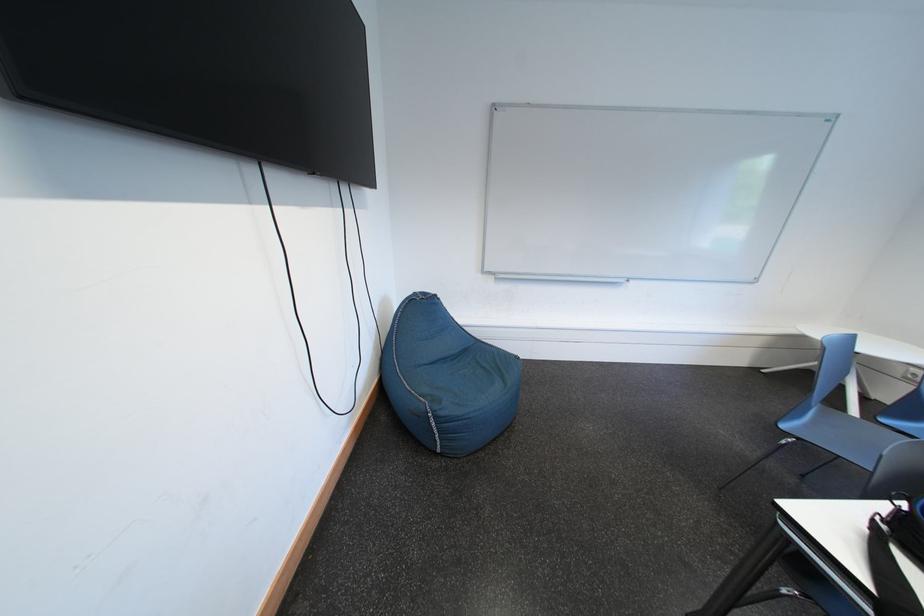
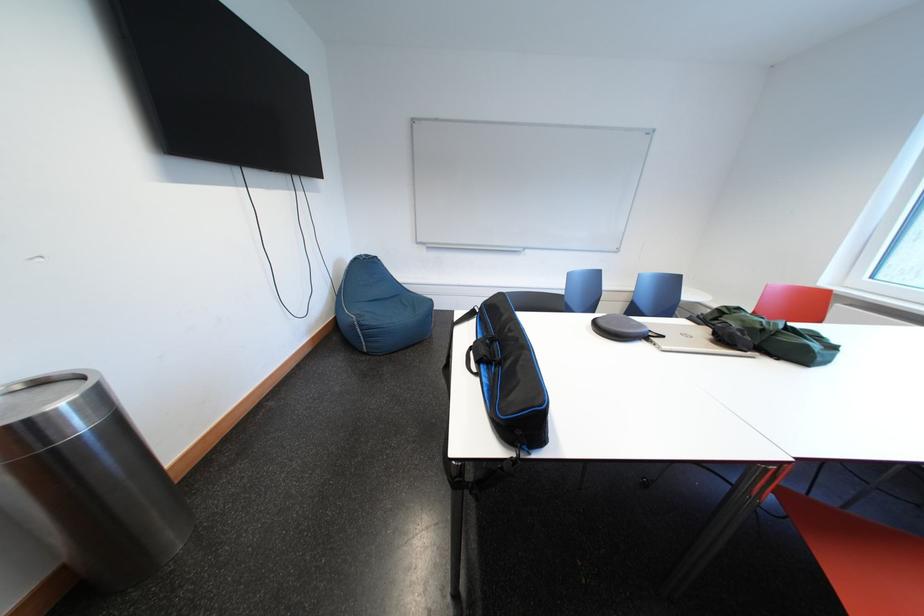
Locate, in the second image, the point that corresponds to point 445,421 in the first image.

(370, 330)